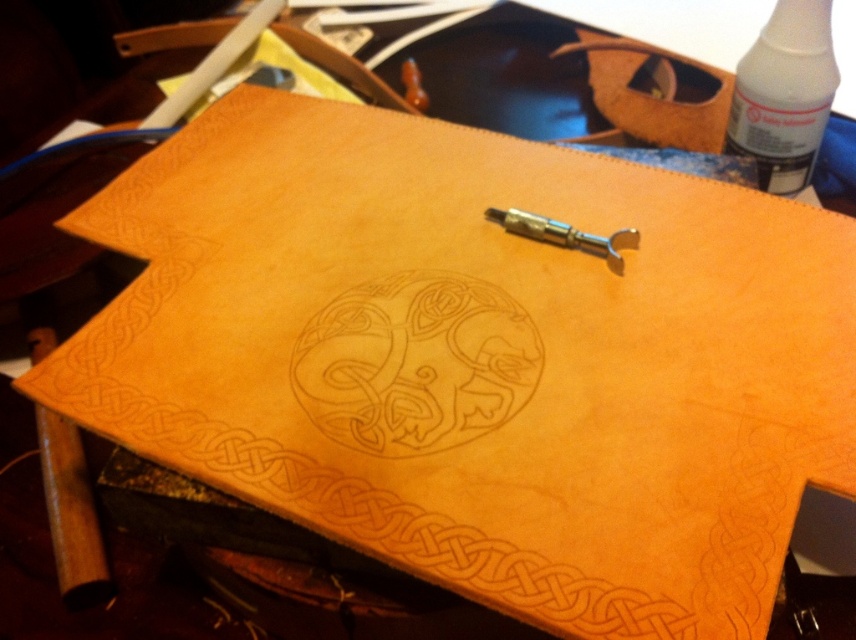
Does light brown leather design at center have a lesser height compared to polished brass tool at center?

In fact, light brown leather design at center may be taller than polished brass tool at center.

The image size is (856, 640). Describe the element at coordinates (415, 364) in the screenshot. I see `light brown leather design at center` at that location.

Find the location of a particular element. This screenshot has height=640, width=856. light brown leather design at center is located at coordinates (415, 364).

You are a GUI agent. You are given a task and a screenshot of the screen. Output one action in this format:
    pyautogui.click(x=<x>, y=<y>)
    Task: Click on the light brown leather design at center
    The width and height of the screenshot is (856, 640).
    Given the screenshot: What is the action you would take?
    pyautogui.click(x=415, y=364)

Which of these two, light brown leather design at center or white glossy bottle at upper right, stands shorter?

light brown leather design at center

Does point (361, 355) lie in front of point (768, 122)?

Yes, it is in front of point (768, 122).

Identify the location of light brown leather design at center. (415, 364).

Consider the image. Between white glossy bottle at upper right and polished brass tool at center, which one is positioned lower?

polished brass tool at center is lower down.

Who is positioned more to the right, white glossy bottle at upper right or polished brass tool at center?

white glossy bottle at upper right is more to the right.

What do you see at coordinates (783, 93) in the screenshot?
I see `white glossy bottle at upper right` at bounding box center [783, 93].

At what (x,y) coordinates should I click in order to perform the action: click on white glossy bottle at upper right. Please return your answer as a coordinate pair (x, y). Looking at the image, I should click on (783, 93).